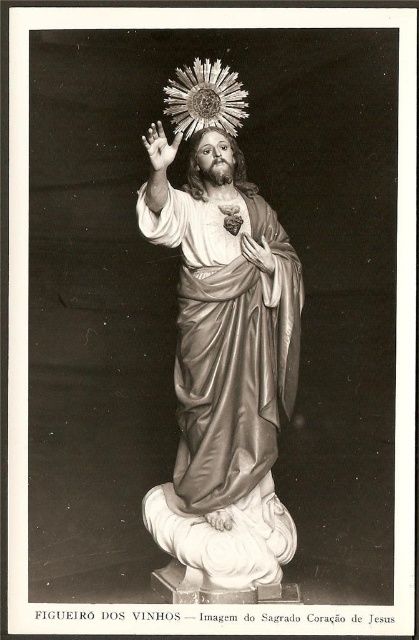
Question: Does matte gold hand at center appear on the left side of matte gold hand at lower center?

Choices:
 (A) yes
 (B) no

Answer: (B)

Question: Among these points, which one is nearest to the camera?

Choices:
 (A) (229, 525)
 (B) (157, 150)

Answer: (B)

Question: Which point appears closest to the camera in this image?

Choices:
 (A) (266, 272)
 (B) (165, 148)
 (C) (219, 515)
 (D) (243, 301)

Answer: (B)

Question: Among these points, which one is farthest from the camera?

Choices:
 (A) (165, 164)
 (B) (214, 528)
 (C) (250, 243)

Answer: (C)

Question: Considering the relative positions of shiny silver robe at center and matte gold hand at center in the image provided, where is shiny silver robe at center located with respect to matte gold hand at center?

Choices:
 (A) below
 (B) above

Answer: (A)

Question: Can you confirm if shiny silver robe at center is positioned below matte gold hand at lower center?

Choices:
 (A) yes
 (B) no

Answer: (B)